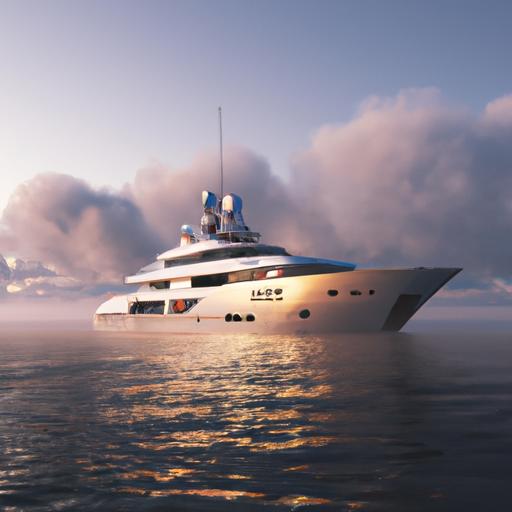
Where is `window`? The width and height of the screenshot is (512, 512). window is located at coordinates (204, 280).